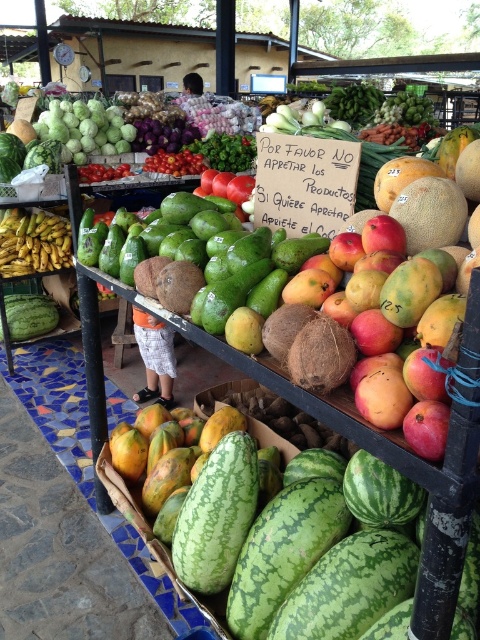
You are a customer at the fruit market and want to reach the yellow bananas at left from the ripe mangoes at center. Considering the distance between them, can you comfortably walk through the space between the two without needing to move any items?

The distance between the ripe mangoes at center and the yellow bananas at left is 9.07 feet, which is more than enough space for a person to walk through comfortably without needing to move any items.

Based on the photo, you are a vendor at the fruit market and need to stack boxes on a shelf that can hold items up to 1 meter in width. You have a green textured watermelon at center and ripe mangoes at center. Can both items fit side by side on the shelf?

The green textured watermelon at center might be wider than ripe mangoes at center. Since the shelf can hold items up to 1 meter in width, if the watermelon is indeed wider, their combined width may exceed the limit, so it is uncertain if both can fit side by side without exceeding the shelf capacity.